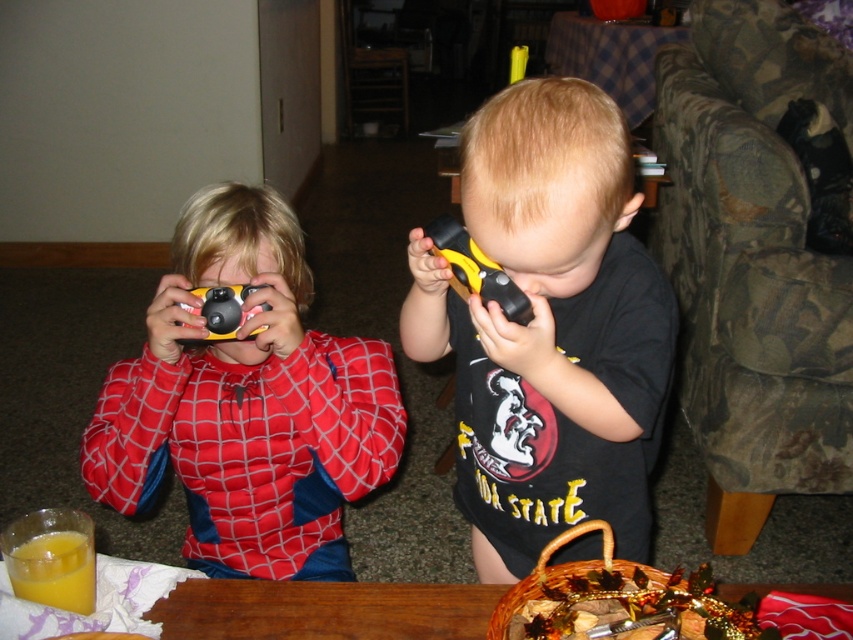
How much distance is there between black matte toy phone at center and matte black toy at center?

black matte toy phone at center and matte black toy at center are 13.15 inches apart from each other.

Which is behind, point (469, 323) or point (209, 340)?

The point (469, 323) is more distant.

The height and width of the screenshot is (640, 853). I want to click on black matte toy phone at center, so click(549, 328).

Which is below, black matte toy phone at center or yellow plastic flashlight at center?

black matte toy phone at center is lower down.

Can you confirm if black matte toy phone at center is bigger than yellow plastic flashlight at center?

Correct, black matte toy phone at center is larger in size than yellow plastic flashlight at center.

Which is behind, point (521, 264) or point (459, 230)?

Point (459, 230)

At what (x,y) coordinates should I click in order to perform the action: click on black matte toy phone at center. Please return your answer as a coordinate pair (x, y). The width and height of the screenshot is (853, 640). Looking at the image, I should click on (549, 328).

Is point (614, 408) positioned before point (47, 566)?

That is False.

You are a GUI agent. You are given a task and a screenshot of the screen. Output one action in this format:
    pyautogui.click(x=<x>, y=<y>)
    Task: Click on the black matte toy phone at center
    The width and height of the screenshot is (853, 640).
    Given the screenshot: What is the action you would take?
    pyautogui.click(x=549, y=328)